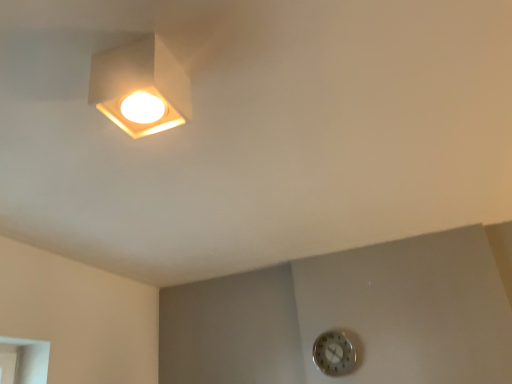
Question: Is matte white square lamp at upper left completely or partially inside metallic silver clock at lower right?

Choices:
 (A) yes
 (B) no

Answer: (B)

Question: From a real-world perspective, is metallic silver clock at lower right below matte white square lamp at upper left?

Choices:
 (A) no
 (B) yes

Answer: (B)

Question: Is metallic silver clock at lower right at the right side of matte white square lamp at upper left?

Choices:
 (A) no
 (B) yes

Answer: (B)

Question: Is the depth of metallic silver clock at lower right greater than that of matte white square lamp at upper left?

Choices:
 (A) no
 (B) yes

Answer: (B)

Question: From the image's perspective, is metallic silver clock at lower right over matte white square lamp at upper left?

Choices:
 (A) no
 (B) yes

Answer: (A)

Question: Does metallic silver clock at lower right have a larger size compared to matte white square lamp at upper left?

Choices:
 (A) no
 (B) yes

Answer: (A)

Question: Is matte white square lamp at upper left further to camera compared to metallic silver clock at lower right?

Choices:
 (A) no
 (B) yes

Answer: (A)

Question: From a real-world perspective, does matte white square lamp at upper left sit lower than metallic silver clock at lower right?

Choices:
 (A) no
 (B) yes

Answer: (A)

Question: Is metallic silver clock at lower right inside matte white square lamp at upper left?

Choices:
 (A) yes
 (B) no

Answer: (B)

Question: Is matte white square lamp at upper left facing towards metallic silver clock at lower right?

Choices:
 (A) no
 (B) yes

Answer: (A)

Question: Considering the relative sizes of matte white square lamp at upper left and metallic silver clock at lower right in the image provided, is matte white square lamp at upper left taller than metallic silver clock at lower right?

Choices:
 (A) no
 (B) yes

Answer: (A)

Question: From a real-world perspective, is matte white square lamp at upper left on top of metallic silver clock at lower right?

Choices:
 (A) yes
 (B) no

Answer: (A)

Question: Is matte white square lamp at upper left wider or thinner than metallic silver clock at lower right?

Choices:
 (A) wide
 (B) thin

Answer: (A)